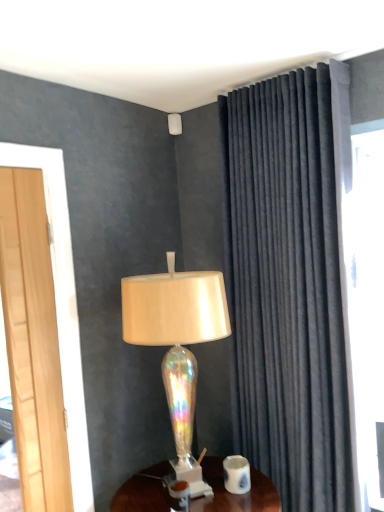
In order to face velvet dark gray curtain at right, should I rotate leftwards or rightwards?

Turn right by 12.396 degrees to look at velvet dark gray curtain at right.

Find the location of a particular element. velvet dark gray curtain at right is located at coordinates (286, 289).

At what (x,y) coordinates should I click in order to perform the action: click on iridescent glass lampshade at upper center, which is counted as the 2th lamp, starting from the bottom. Please return your answer as a coordinate pair (x, y). The height and width of the screenshot is (512, 384). Looking at the image, I should click on (175, 123).

Find the location of `wooden desk at center`. wooden desk at center is located at coordinates (234, 494).

Image resolution: width=384 pixels, height=512 pixels. In order to click on white glossy coffee cup at lower center in this screenshot , I will do `click(236, 474)`.

Does point (237, 362) come closer to viewer compared to point (169, 129)?

Yes, it is.

Can you confirm if velvet dark gray curtain at right is smaller than iridescent glass lampshade at upper center, marked as the 1th lamp in a left-to-right arrangement?

Incorrect, velvet dark gray curtain at right is not smaller in size than iridescent glass lampshade at upper center, marked as the 1th lamp in a left-to-right arrangement.

This screenshot has width=384, height=512. In order to click on curtain on the right of iridescent glass lampshade at upper center, arranged as the 1th lamp when viewed from the top in this screenshot , I will do `click(286, 289)`.

Is velvet dark gray curtain at right looking in the opposite direction of iridescent glass lampshade at upper center, which is counted as the 2th lamp, starting from the bottom?

No.

From the image's perspective, is wooden desk at center below velvet dark gray curtain at right?

Correct, wooden desk at center appears lower than velvet dark gray curtain at right in the image.

Is the position of wooden desk at center more distant than that of velvet dark gray curtain at right?

No, the depth of wooden desk at center is less than that of velvet dark gray curtain at right.

Is wooden desk at center oriented away from velvet dark gray curtain at right?

No.

Which of these two, wooden desk at center or velvet dark gray curtain at right, is thinner?

velvet dark gray curtain at right.

Is iridescent glass lampshade at upper center, marked as the 1th lamp in a left-to-right arrangement, facing towards velvet dark gray curtain at right?

Yes, iridescent glass lampshade at upper center, marked as the 1th lamp in a left-to-right arrangement, is oriented towards velvet dark gray curtain at right.

Is iridescent glass lampshade at upper center, the first lamp when ordered from back to front, directly adjacent to velvet dark gray curtain at right?

iridescent glass lampshade at upper center, the first lamp when ordered from back to front, and velvet dark gray curtain at right are not in contact.

Is iridescent glass lampshade at upper center, arranged as the second lamp when viewed from the front, not inside velvet dark gray curtain at right?

Yes, iridescent glass lampshade at upper center, arranged as the second lamp when viewed from the front, is outside of velvet dark gray curtain at right.

Consider the image. Does iridescent glass lamp at center, placed as the 2th lamp when sorted from left to right, have a lesser height compared to wooden desk at center?

No.

Can you tell me how much iridescent glass lamp at center, acting as the first lamp starting from the bottom, and wooden desk at center differ in facing direction?

The facing directions of iridescent glass lamp at center, acting as the first lamp starting from the bottom, and wooden desk at center are 0.741 degrees apart.

Is the depth of iridescent glass lamp at center, the 1th lamp when ordered from front to back, greater than that of wooden desk at center?

That is True.

From the image's perspective, is iridescent glass lamp at center, the second lamp in the back-to-front sequence, under wooden desk at center?

No, from the image's perspective, iridescent glass lamp at center, the second lamp in the back-to-front sequence, is not beneath wooden desk at center.

How distant is iridescent glass lampshade at upper center, which is counted as the 2th lamp, starting from the bottom, from iridescent glass lamp at center, placed as the 2th lamp when sorted from left to right?

The distance of iridescent glass lampshade at upper center, which is counted as the 2th lamp, starting from the bottom, from iridescent glass lamp at center, placed as the 2th lamp when sorted from left to right, is 39.30 inches.

Which object is positioned more to the right, iridescent glass lampshade at upper center, arranged as the 1th lamp when viewed from the top, or iridescent glass lamp at center, acting as the first lamp starting from the bottom?

Positioned to the right is iridescent glass lamp at center, acting as the first lamp starting from the bottom.

From a real-world perspective, is iridescent glass lampshade at upper center, arranged as the 1th lamp when viewed from the top, physically below iridescent glass lamp at center, placed as the 2th lamp when sorted from left to right?

No, from a real-world perspective, iridescent glass lampshade at upper center, arranged as the 1th lamp when viewed from the top, is not below iridescent glass lamp at center, placed as the 2th lamp when sorted from left to right.

Is iridescent glass lampshade at upper center, the first lamp when ordered from back to front, facing away from iridescent glass lamp at center, the second lamp in the back-to-front sequence?

No, iridescent glass lamp at center, the second lamp in the back-to-front sequence, is not at the back of iridescent glass lampshade at upper center, the first lamp when ordered from back to front.

Does point (226, 489) lie behind point (213, 292)?

Yes.

Considering the positions of objects white glossy coffee cup at lower center and iridescent glass lamp at center, acting as the first lamp starting from the bottom, in the image provided, who is more to the left, white glossy coffee cup at lower center or iridescent glass lamp at center, acting as the first lamp starting from the bottom,?

Positioned to the left is iridescent glass lamp at center, acting as the first lamp starting from the bottom.

Considering the sizes of objects white glossy coffee cup at lower center and iridescent glass lamp at center, placed as the 2th lamp when sorted from left to right, in the image provided, who is bigger, white glossy coffee cup at lower center or iridescent glass lamp at center, placed as the 2th lamp when sorted from left to right,?

iridescent glass lamp at center, placed as the 2th lamp when sorted from left to right.

From the image's perspective, is white glossy coffee cup at lower center beneath iridescent glass lamp at center, the second lamp in the back-to-front sequence?

Indeed, from the image's perspective, white glossy coffee cup at lower center is shown beneath iridescent glass lamp at center, the second lamp in the back-to-front sequence.

Does velvet dark gray curtain at right have a lesser width compared to wooden desk at center?

Yes.

Does velvet dark gray curtain at right have a greater height compared to wooden desk at center?

Correct, velvet dark gray curtain at right is much taller as wooden desk at center.

From the image's perspective, which one is positioned lower, velvet dark gray curtain at right or wooden desk at center?

From the image's view, wooden desk at center is below.

At what (x,y) coordinates should I click in order to perform the action: click on curtain that appears below the iridescent glass lampshade at upper center, arranged as the second lamp when viewed from the front (from the image's perspective). Please return your answer as a coordinate pair (x, y). The width and height of the screenshot is (384, 512). Looking at the image, I should click on (286, 289).

Locate an element on the screen. This screenshot has width=384, height=512. desk on the left of velvet dark gray curtain at right is located at coordinates (234, 494).

Which object lies nearer to the anchor point iridescent glass lampshade at upper center, the first lamp when ordered from back to front, wooden desk at center or iridescent glass lamp at center, placed as the 2th lamp when sorted from left to right?

The object closer to iridescent glass lampshade at upper center, the first lamp when ordered from back to front, is iridescent glass lamp at center, placed as the 2th lamp when sorted from left to right.

When comparing their distances from iridescent glass lamp at center, the second lamp in the back-to-front sequence, does wooden desk at center or iridescent glass lampshade at upper center, arranged as the 1th lamp when viewed from the top, seem further?

iridescent glass lampshade at upper center, arranged as the 1th lamp when viewed from the top.

When comparing their distances from iridescent glass lamp at center, the first lamp viewed from the right, does wooden desk at center or white glossy coffee cup at lower center seem further?

wooden desk at center.

Based on their spatial positions, is white glossy coffee cup at lower center or iridescent glass lamp at center, the 1th lamp when ordered from front to back, further from velvet dark gray curtain at right?

white glossy coffee cup at lower center.

Which object lies further to the anchor point iridescent glass lamp at center, placed as the 2th lamp when sorted from top to bottom, velvet dark gray curtain at right or iridescent glass lampshade at upper center, which is counted as the 2th lamp, starting from the bottom?

Based on the image, iridescent glass lampshade at upper center, which is counted as the 2th lamp, starting from the bottom, appears to be further to iridescent glass lamp at center, placed as the 2th lamp when sorted from top to bottom.

Based on their spatial positions, is white glossy coffee cup at lower center or iridescent glass lampshade at upper center, which is counted as the 2th lamp, starting from the bottom, closer to velvet dark gray curtain at right?

white glossy coffee cup at lower center lies closer to velvet dark gray curtain at right than the other object.

Which object lies further to the anchor point velvet dark gray curtain at right, iridescent glass lampshade at upper center, the first lamp when ordered from back to front, or iridescent glass lamp at center, the 1th lamp when ordered from front to back?

The object further to velvet dark gray curtain at right is iridescent glass lampshade at upper center, the first lamp when ordered from back to front.

Based on their spatial positions, is iridescent glass lamp at center, placed as the 2th lamp when sorted from top to bottom, or iridescent glass lampshade at upper center, the first lamp when ordered from back to front, closer to velvet dark gray curtain at right?

Among the two, iridescent glass lamp at center, placed as the 2th lamp when sorted from top to bottom, is located nearer to velvet dark gray curtain at right.

Where is `coffee cup between velvet dark gray curtain at right and wooden desk at center in the up-down direction`? Image resolution: width=384 pixels, height=512 pixels. coffee cup between velvet dark gray curtain at right and wooden desk at center in the up-down direction is located at coordinates (236, 474).

I want to click on coffee cup between iridescent glass lamp at center, the 1th lamp when ordered from front to back, and wooden desk at center vertically, so click(236, 474).

Identify the location of lamp that lies between iridescent glass lampshade at upper center, the first lamp when ordered from back to front, and white glossy coffee cup at lower center from top to bottom. This screenshot has height=512, width=384. (177, 343).

At what (x,y) coordinates should I click in order to perform the action: click on curtain between iridescent glass lampshade at upper center, arranged as the 1th lamp when viewed from the top, and iridescent glass lamp at center, the 1th lamp when ordered from front to back, vertically. Please return your answer as a coordinate pair (x, y). This screenshot has height=512, width=384. Looking at the image, I should click on (286, 289).